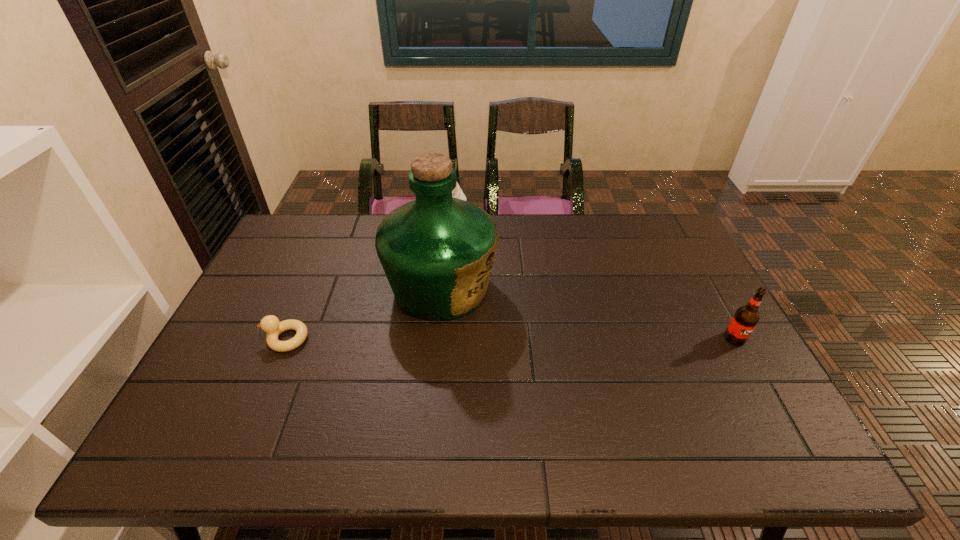
You are a GUI agent. You are given a task and a screenshot of the screen. Output one action in this format:
    pyautogui.click(x=<x>, y=<y>)
    Task: Click on the free space between the tallest object and the rightmost object
    The width and height of the screenshot is (960, 540).
    Given the screenshot: What is the action you would take?
    pyautogui.click(x=588, y=313)

The width and height of the screenshot is (960, 540). What are the coordinates of `free space between the farthest object and the root beer` in the screenshot? It's located at (596, 279).

Where is `free spot between the root beer and the liquor`? The height and width of the screenshot is (540, 960). free spot between the root beer and the liquor is located at coordinates (588, 313).

Find the location of `object that is the nearest to the farthest object`. object that is the nearest to the farthest object is located at coordinates (437, 252).

Identify which object is located as the second nearest to the duckling. Please provide its 2D coordinates. Your answer should be formatted as a tuple, i.e. [(x, y)], where the tuple contains the x and y coordinates of a point satisfying the conditions above.

[(457, 192)]

At what (x,y) coordinates should I click in order to perform the action: click on vacant point that satisfies the following two spatial constraints: 1. on the back side of the icecream; 2. on the right side of the tallest object. Please return your answer as a coordinate pair (x, y). Looking at the image, I should click on (447, 219).